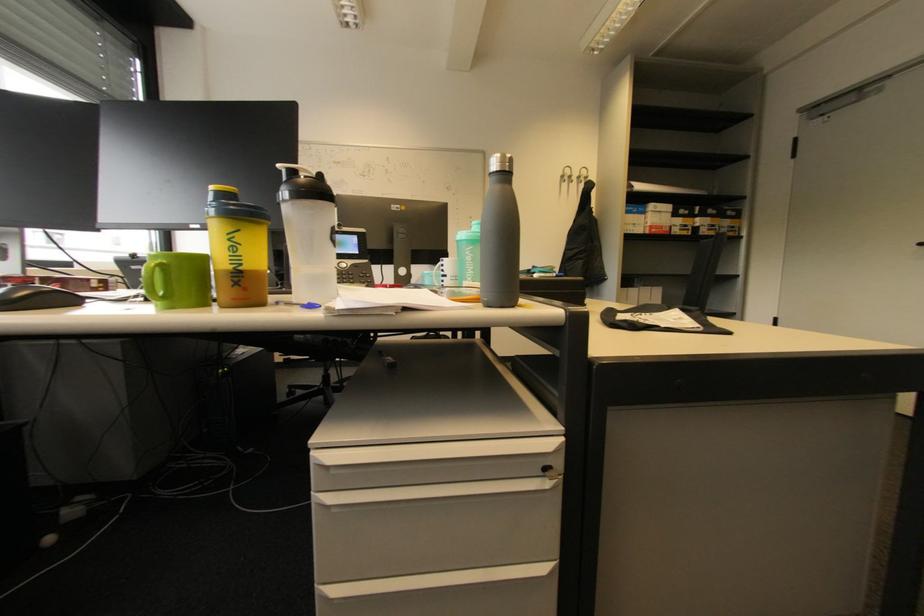
Find where to insert the cabinet keyhole. Please return your answer as a coordinate pair (x, y).

(552, 474)